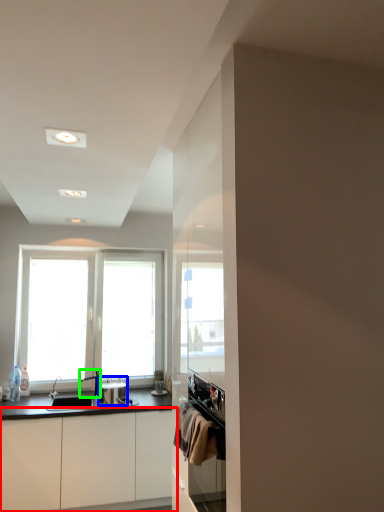
Question: Estimate the real-world distances between objects in this image. Which object is farther from cabinetry (highlighted by a red box), appliance (highlighted by a blue box) or faucet (highlighted by a green box)?

Choices:
 (A) appliance
 (B) faucet

Answer: (B)